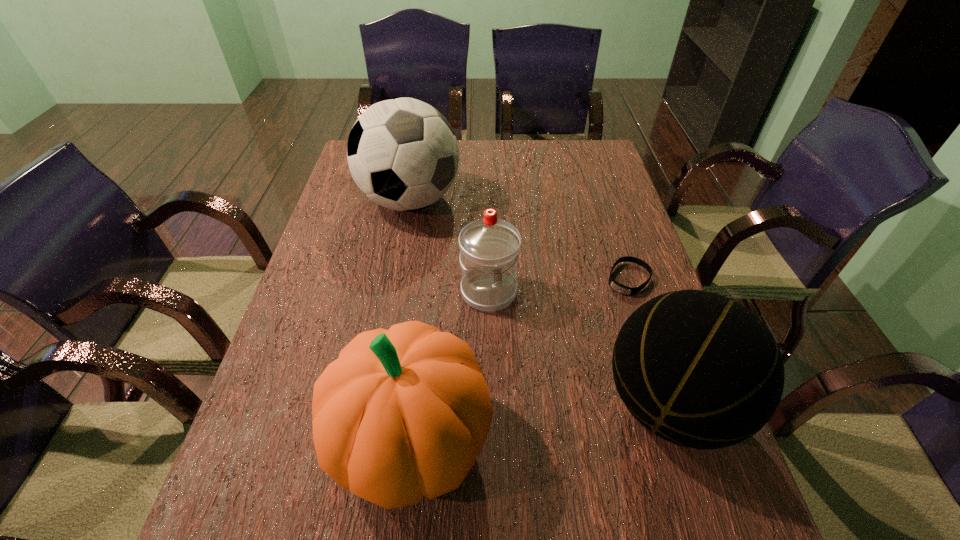
Image resolution: width=960 pixels, height=540 pixels. I want to click on vacant space on the desktop that is between the pumpkin and the basketball and is positioned on the display of the wristband, so click(x=525, y=424).

Locate an element on the screen. The height and width of the screenshot is (540, 960). free space on the desktop that is between the pumpkin and the basketball and is positioned on the main logo of the farthest object is located at coordinates (520, 425).

In order to click on vacant space on the desktop that is between the pumpkin and the basketball and is positioned on the handle side of the water bottle in this screenshot , I will do `click(554, 420)`.